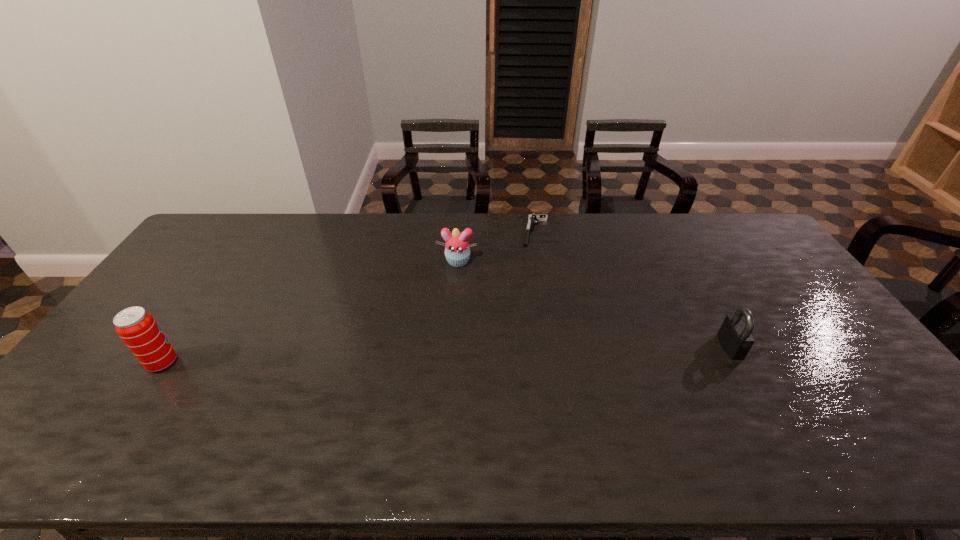
Locate an element on the screen. The width and height of the screenshot is (960, 540). vacant space located 0.170m on the face of the second object from left to right is located at coordinates pyautogui.click(x=445, y=305).

Identify the location of vacant space located 0.150m on the face of the second object from left to right. (446, 301).

Where is `vacant region located 0.150m on the front-facing side of the pistol`? This screenshot has height=540, width=960. vacant region located 0.150m on the front-facing side of the pistol is located at coordinates (531, 274).

I want to click on free space located on the front-facing side of the pistol, so click(528, 297).

Locate an element on the screen. This screenshot has width=960, height=540. vacant region located 0.310m on the front-facing side of the pistol is located at coordinates (526, 308).

Image resolution: width=960 pixels, height=540 pixels. I want to click on object at the far edge, so click(532, 218).

The height and width of the screenshot is (540, 960). What are the coordinates of `object at the left edge` in the screenshot? It's located at 137,328.

In the image, there is a desktop. At what (x,y) coordinates should I click in order to perform the action: click on blank space at the far edge. Please return your answer as a coordinate pair (x, y). Looking at the image, I should click on (518, 248).

What are the coordinates of `vacant space at the near edge of the desktop` in the screenshot? It's located at (155, 394).

Find the location of a particular element. Image resolution: width=960 pixels, height=540 pixels. vacant area at the left edge is located at coordinates (169, 273).